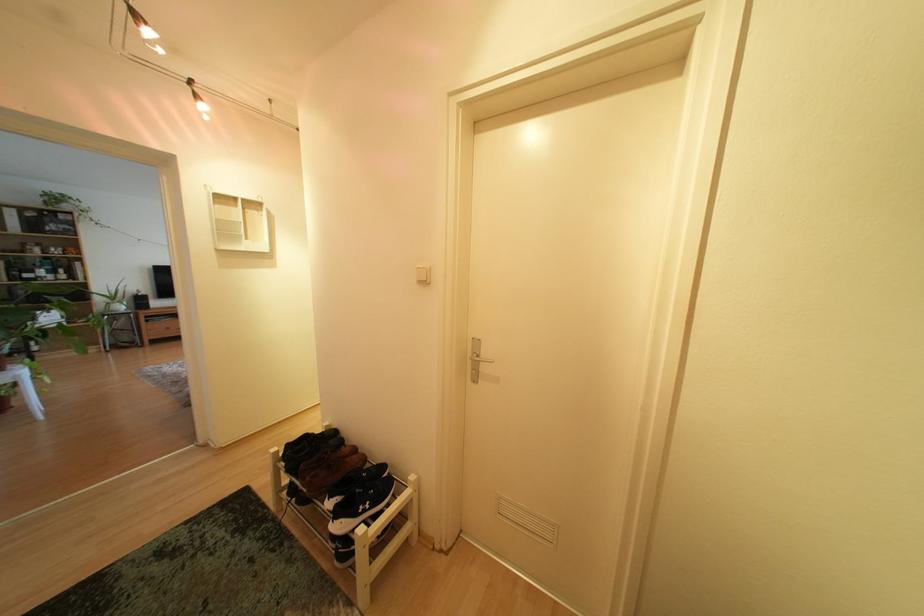
Where would you lift the black and white shoe? Please return your answer as a coordinate pair (x, y).

(360, 504)